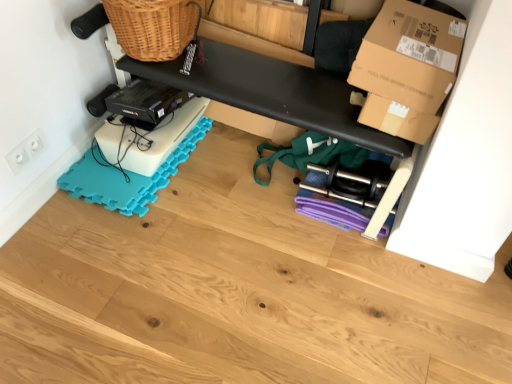
Find the location of a particular element. free space in front of black matte bench at upper center is located at coordinates (233, 192).